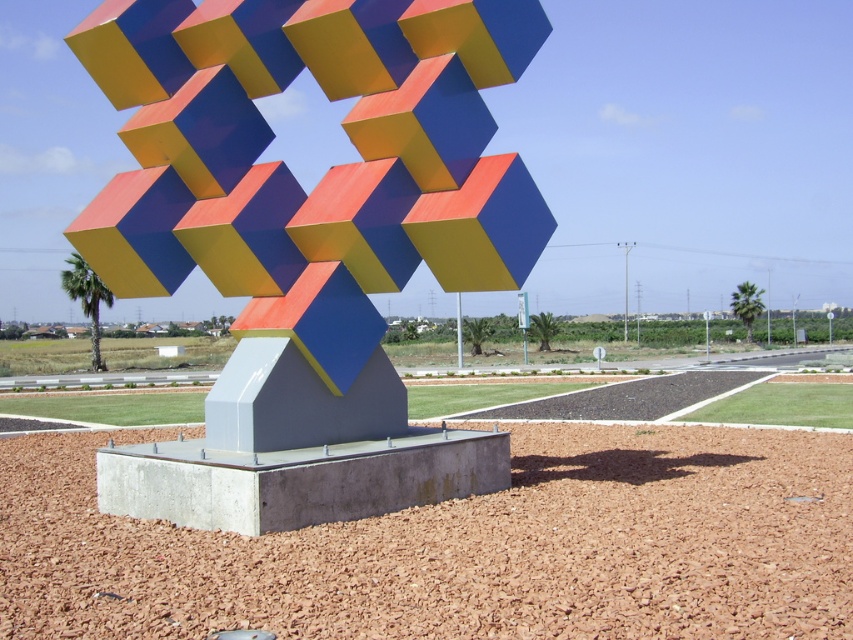
You are standing at the base of the sculpture and want to place a new cube exactly at point (308, 236). According to the scene description, what type of cube is already present at that location?

At point (308, 236) lies a matte painted cube at center.